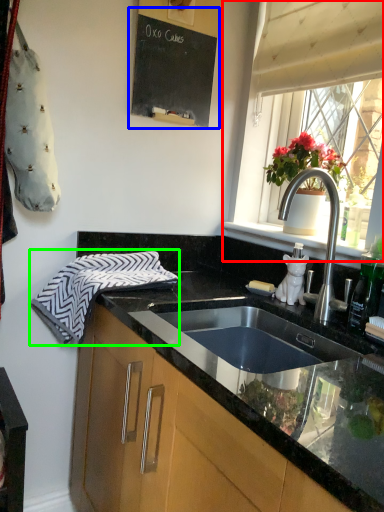
Question: Considering the real-world distances, which object is closest to window (highlighted by a red box)? bulletin board (highlighted by a blue box) or hand towel (highlighted by a green box).

Choices:
 (A) bulletin board
 (B) hand towel

Answer: (A)